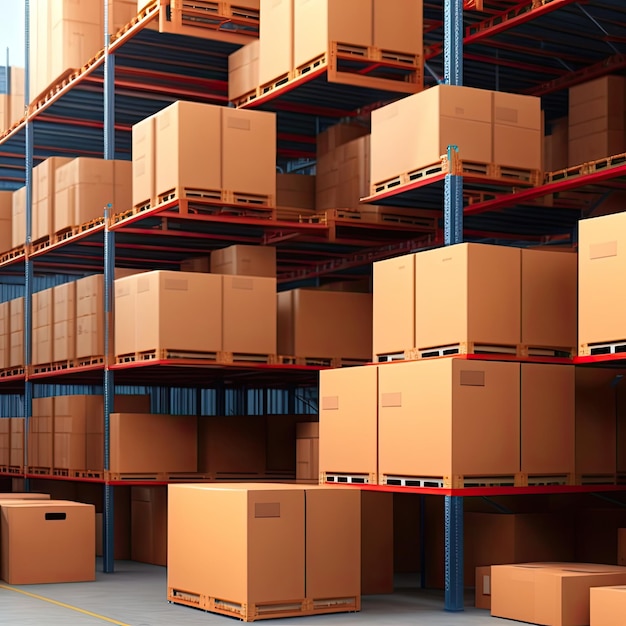
In order to click on shelving in this screenshot , I will do `click(578, 173)`, `click(511, 16)`, `click(121, 29)`, `click(81, 227)`, `click(69, 361)`, `click(602, 352)`, `click(287, 364)`, `click(298, 226)`.